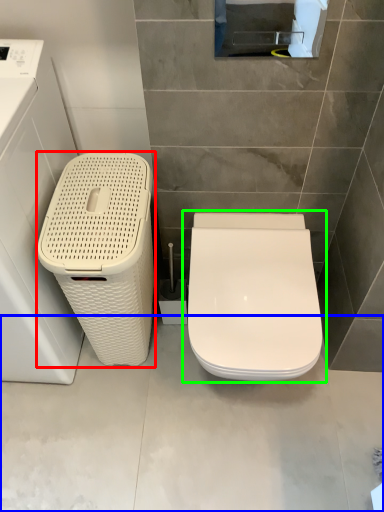
Question: Based on their relative distances, which object is farther from dish washer (highlighted by a red box)? Choose from concrete (highlighted by a blue box) and toilet (highlighted by a green box).

Choices:
 (A) concrete
 (B) toilet

Answer: (A)